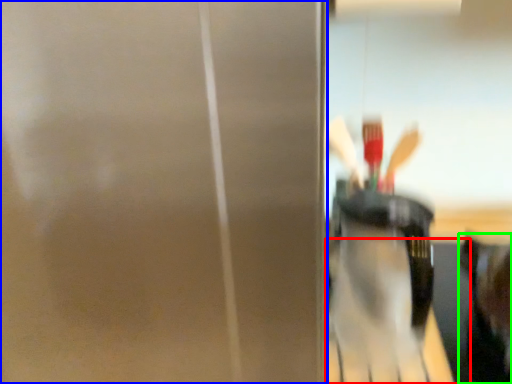
Question: Which object is positioned farthest from table (highlighted by a red box)? Select from screen door (highlighted by a blue box) and person (highlighted by a green box).

Choices:
 (A) screen door
 (B) person

Answer: (A)